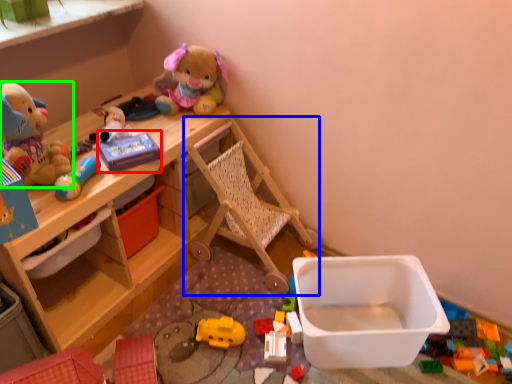
Question: Which object is the farthest from toy (highlighted by a red box)? Choose among these: baby carriage (highlighted by a blue box) or toy (highlighted by a green box).

Choices:
 (A) baby carriage
 (B) toy

Answer: (A)